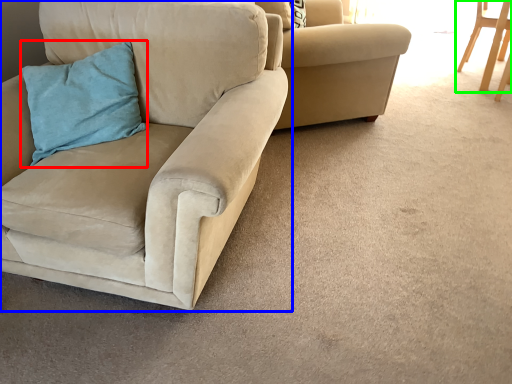
Question: Which object is positioned closest to pillow (highlighted by a red box)? Select from chair (highlighted by a blue box) and chair (highlighted by a green box).

Choices:
 (A) chair
 (B) chair

Answer: (A)